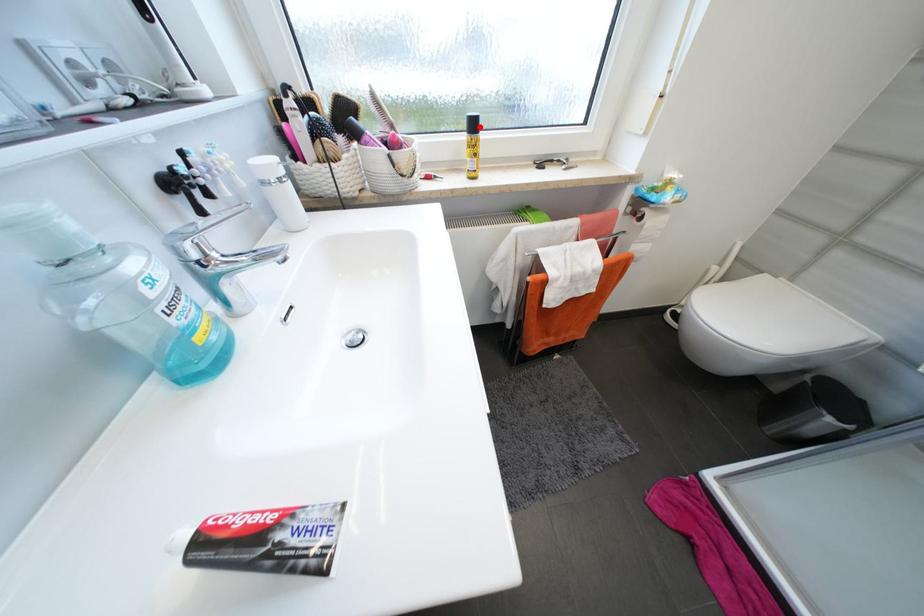
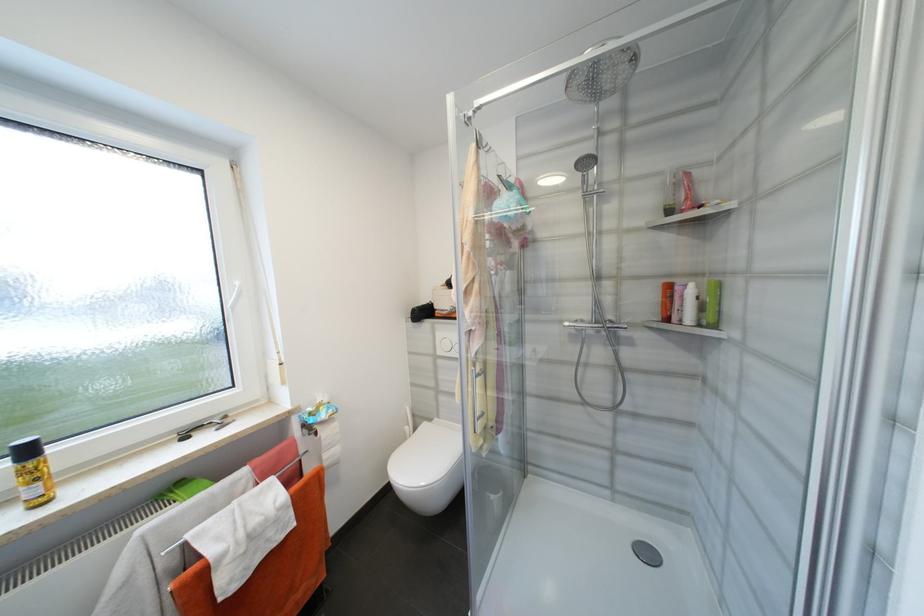
Find the pixel in the second image that matches the highlighted location in the first image.

(33, 453)